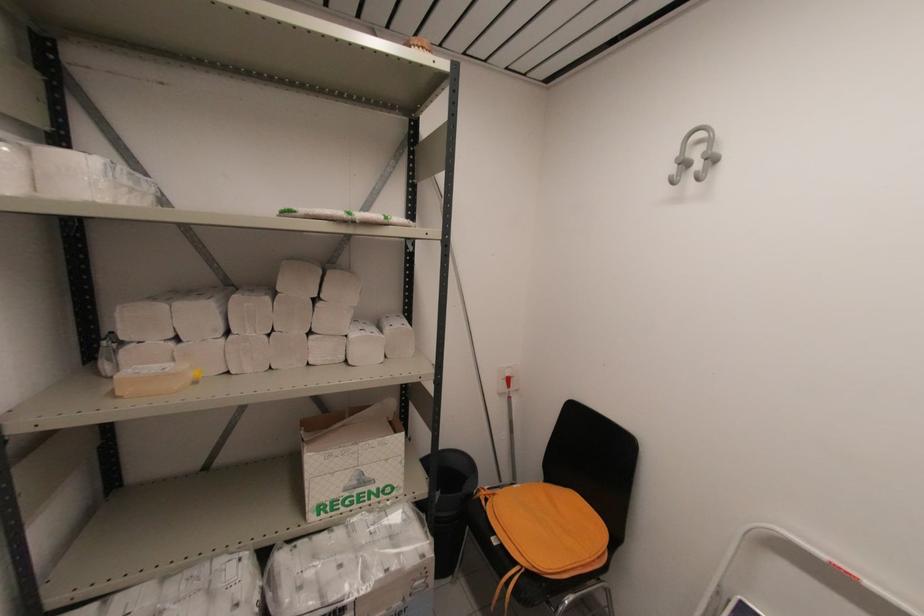
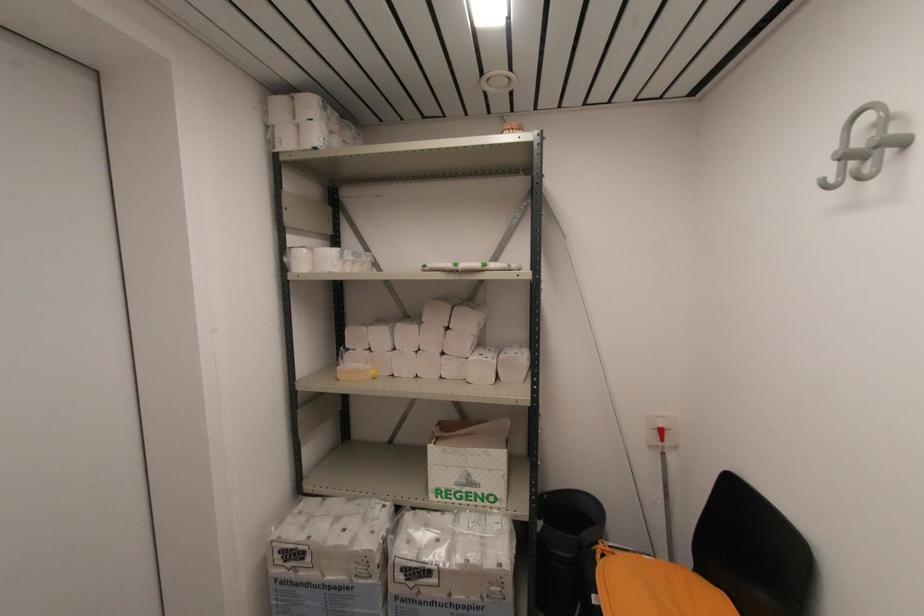
Question: I am providing you with two images of the same scene from different viewpoints. Which of the following objects are not visible in image2?

Choices:
 (A) orange chair sitting surface
 (B) yellow tape dispenser
 (C) paper towel package
 (D) none of these

Answer: (D)